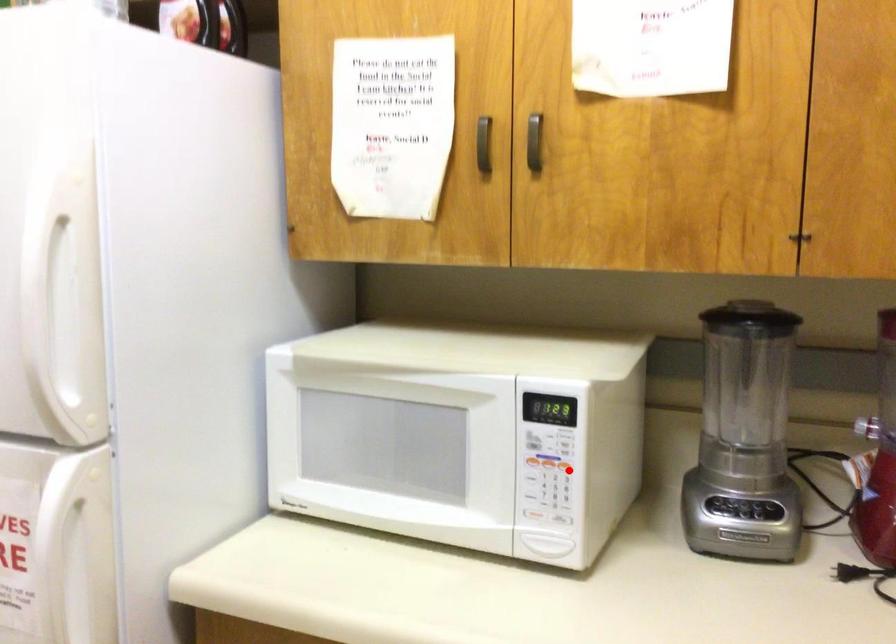
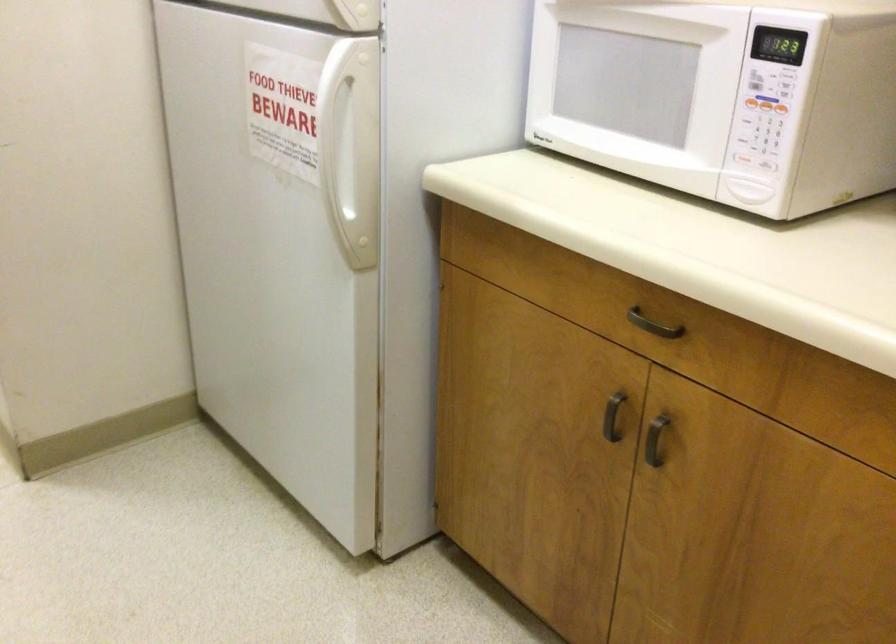
Find the pixel in the second image that matches the highlighted location in the first image.

(780, 108)